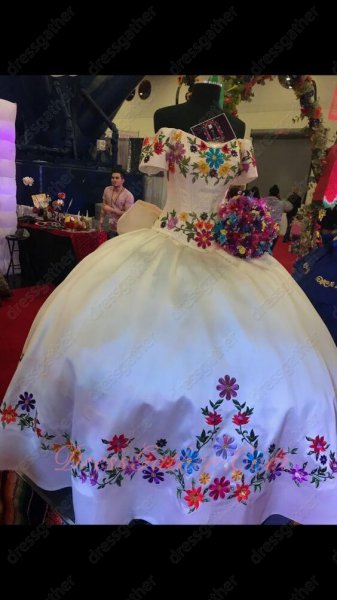
This screenshot has height=600, width=337. I want to click on table leg, so click(8, 494).